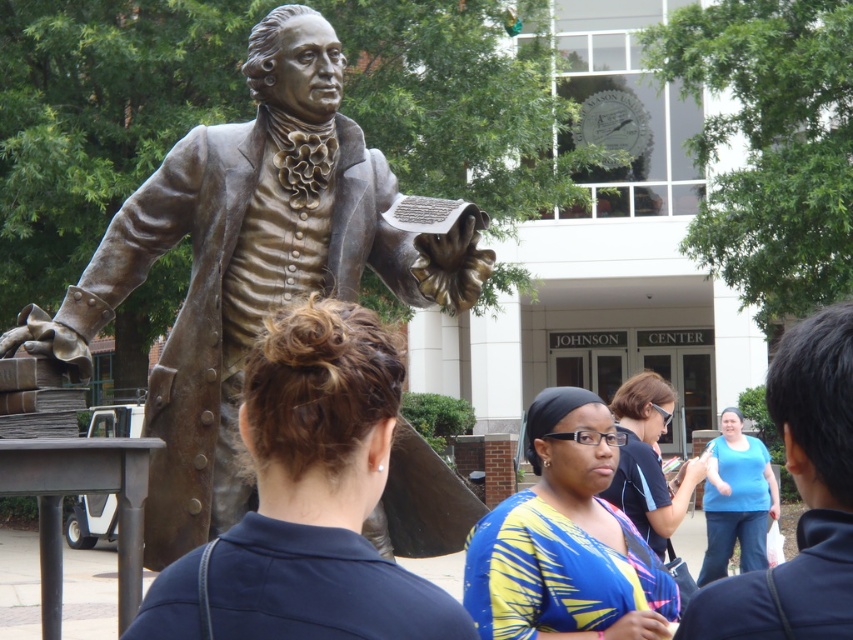
You are standing in a park and see the bronze statue at left. If you want to take a photo of it from the front, where should you position yourself relative to the statue?

To take a photo of the bronze statue at left from the front, you should position yourself directly in front of it, facing the statue.